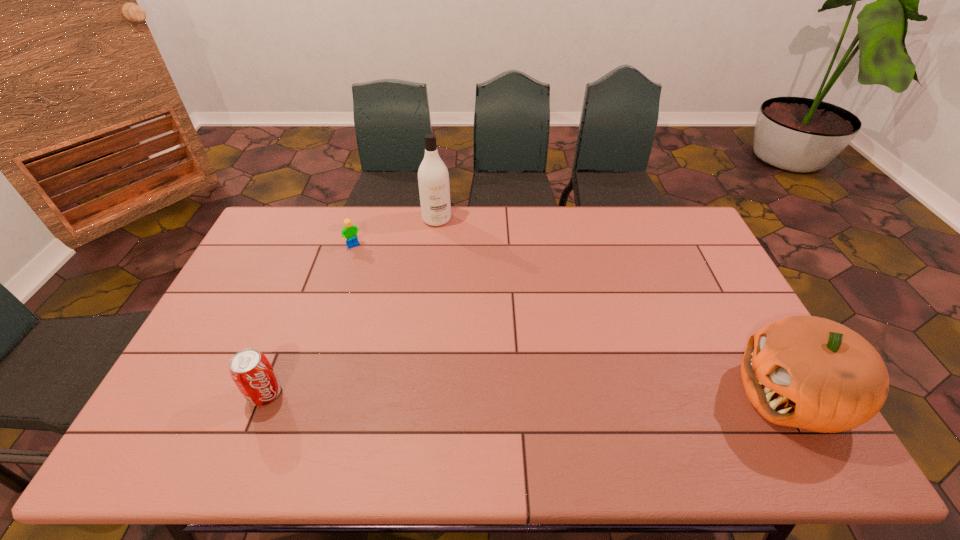
The width and height of the screenshot is (960, 540). Identify the location of soda that is at the near edge. (251, 371).

Locate an element on the screen. pumpkin that is positioned at the near edge is located at coordinates (807, 372).

At what (x,y) coordinates should I click in order to perform the action: click on object located at the right edge. Please return your answer as a coordinate pair (x, y). Looking at the image, I should click on (807, 372).

You are a GUI agent. You are given a task and a screenshot of the screen. Output one action in this format:
    pyautogui.click(x=<x>, y=<y>)
    Task: Click on the object that is at the near right corner
    
    Given the screenshot: What is the action you would take?
    pyautogui.click(x=807, y=372)

Identify the location of vacant space at the far edge of the desktop. This screenshot has width=960, height=540. (570, 233).

The height and width of the screenshot is (540, 960). Identify the location of vacant space at the near edge of the desktop. (670, 413).

Image resolution: width=960 pixels, height=540 pixels. What are the coordinates of `free region at the left edge` in the screenshot? It's located at (223, 334).

In the image, there is a desktop. Where is `vacant space at the right edge`? vacant space at the right edge is located at coordinates (704, 264).

Where is `vacant area at the near left corner`? The width and height of the screenshot is (960, 540). vacant area at the near left corner is located at coordinates (191, 407).

Identify the location of empty location between the rightmost object and the Lego. (x=573, y=321).